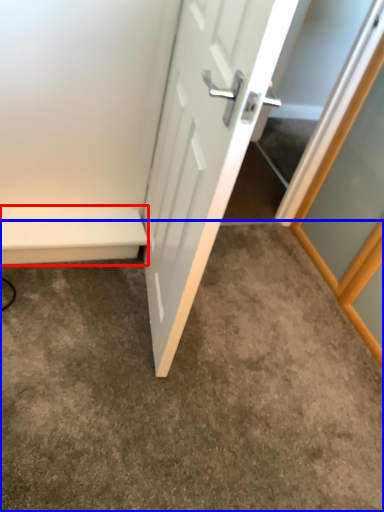
Question: Among these objects, which one is farthest to the camera, balustrade (highlighted by a red box) or concrete (highlighted by a blue box)?

Choices:
 (A) balustrade
 (B) concrete

Answer: (A)